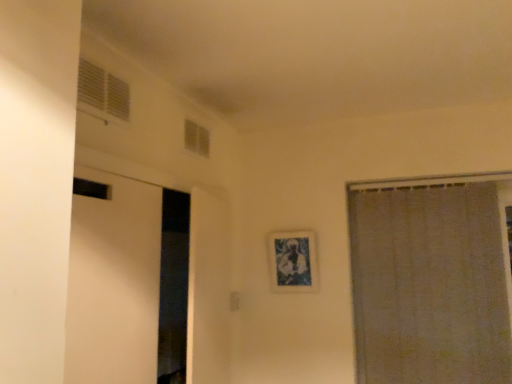
Question: Considering the positions of white plastic vent at upper left, the second window in the back-to-front sequence, and white sheer curtain at right in the image, is white plastic vent at upper left, the second window in the back-to-front sequence, bigger or smaller than white sheer curtain at right?

Choices:
 (A) small
 (B) big

Answer: (A)

Question: In the image, is white plastic vent at upper left, which ranks as the first window in left-to-right order, on the left side or the right side of white sheer curtain at right?

Choices:
 (A) left
 (B) right

Answer: (A)

Question: Estimate the real-world distances between objects in this image. Which object is farther from the white plastic vent at upper left, the second window in the back-to-front sequence?

Choices:
 (A) transparent glass window at upper center, which appears as the first window when viewed from the right
 (B) blue textured fabric picture frame at center
 (C) white sheer curtain at right

Answer: (C)

Question: Which object is positioned closest to the transparent glass window at upper center, positioned as the first window in back-to-front order?

Choices:
 (A) blue textured fabric picture frame at center
 (B) white plastic vent at upper left, the second window in the back-to-front sequence
 (C) white sheer curtain at right

Answer: (B)